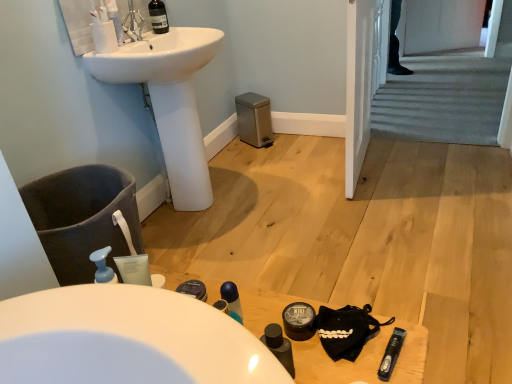
Question: Should I look upward or downward to see black matte table at lower center?

Choices:
 (A) down
 (B) up

Answer: (A)

Question: Is there a large distance between white glossy sink at upper left and translucent plastic mouthwash at upper left, the third mouthwash in the right-to-left sequence?

Choices:
 (A) yes
 (B) no

Answer: (B)

Question: Does white glossy sink at upper left appear on the right side of translucent plastic mouthwash at upper left, the third mouthwash in the right-to-left sequence?

Choices:
 (A) no
 (B) yes

Answer: (B)

Question: Does white glossy sink at upper left appear on the left side of translucent plastic mouthwash at upper left, which appears as the 1th mouthwash when viewed from the back?

Choices:
 (A) yes
 (B) no

Answer: (B)

Question: Considering the relative sizes of white glossy sink at upper left and translucent plastic mouthwash at upper left, which is counted as the first mouthwash, starting from the left, in the image provided, is white glossy sink at upper left thinner than translucent plastic mouthwash at upper left, which is counted as the first mouthwash, starting from the left,?

Choices:
 (A) no
 (B) yes

Answer: (A)

Question: Is white glossy sink at upper left taller than translucent plastic mouthwash at upper left, acting as the 3th mouthwash starting from the front?

Choices:
 (A) yes
 (B) no

Answer: (A)

Question: Is white glossy sink at upper left outside of translucent plastic mouthwash at upper left, acting as the 3th mouthwash starting from the front?

Choices:
 (A) no
 (B) yes

Answer: (B)

Question: From a real-world perspective, is translucent plastic mouthwash at upper left, which is counted as the first mouthwash, starting from the left, positioned under transparent plastic mouthwash at lower right, placed as the 3th mouthwash when sorted from top to bottom, based on gravity?

Choices:
 (A) no
 (B) yes

Answer: (A)

Question: Is translucent plastic mouthwash at upper left, which is the third mouthwash from bottom to top, bigger than transparent plastic mouthwash at lower right, placed as the 3th mouthwash when sorted from top to bottom?

Choices:
 (A) yes
 (B) no

Answer: (A)

Question: Is translucent plastic mouthwash at upper left, which is counted as the first mouthwash, starting from the left, shorter than transparent plastic mouthwash at lower right, placed as the third mouthwash when sorted from back to front?

Choices:
 (A) yes
 (B) no

Answer: (B)

Question: Is translucent plastic mouthwash at upper left, the third mouthwash in the right-to-left sequence, oriented away from transparent plastic mouthwash at lower right, acting as the first mouthwash starting from the bottom?

Choices:
 (A) yes
 (B) no

Answer: (B)

Question: Is translucent plastic mouthwash at upper left, which is counted as the first mouthwash, starting from the left, positioned behind transparent plastic mouthwash at lower right, marked as the first mouthwash in a front-to-back arrangement?

Choices:
 (A) no
 (B) yes

Answer: (B)

Question: Is transparent plastic mouthwash at lower right, placed as the third mouthwash when sorted from back to front, located within translucent plastic mouthwash at upper left, acting as the 3th mouthwash starting from the front?

Choices:
 (A) no
 (B) yes

Answer: (A)

Question: Considering the relative sizes of transparent plastic mouthwash at lower right, the 1th mouthwash from the right, and white glossy sink at upper left in the image provided, is transparent plastic mouthwash at lower right, the 1th mouthwash from the right, wider than white glossy sink at upper left?

Choices:
 (A) yes
 (B) no

Answer: (B)